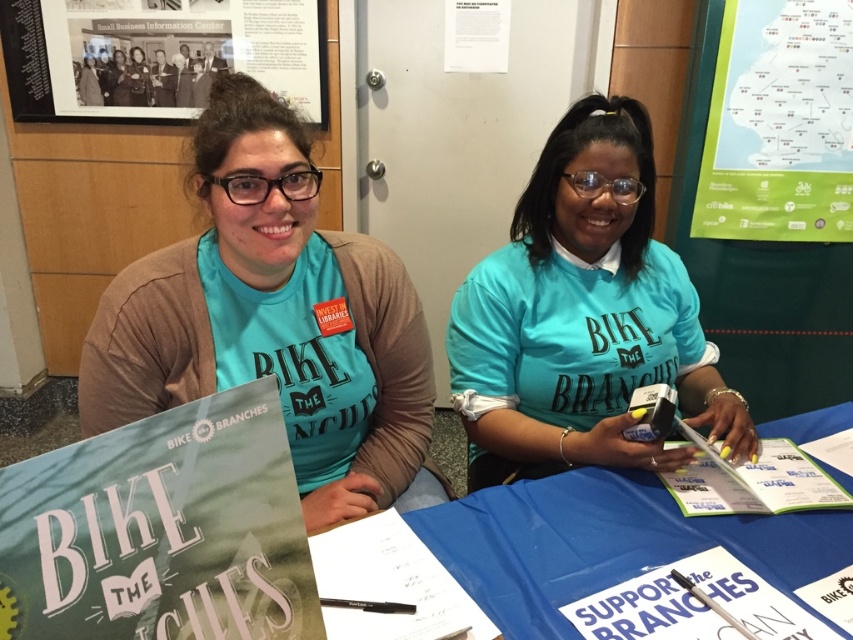
Question: Which point is closer to the camera taking this photo?

Choices:
 (A) (231, 371)
 (B) (221, 592)

Answer: (B)

Question: Does green paper map at upper right have a larger size compared to white paper at lower center?

Choices:
 (A) no
 (B) yes

Answer: (B)

Question: Is blue fabric table at center smaller than white paper at lower center?

Choices:
 (A) yes
 (B) no

Answer: (B)

Question: Which object is the farthest from the blue fabric table at center?

Choices:
 (A) matte green poster at center
 (B) teal matte shirt at center
 (C) green paper map at upper right

Answer: (C)

Question: Is blue fabric table at center smaller than black paper at upper left?

Choices:
 (A) yes
 (B) no

Answer: (B)

Question: Which object is the closest to the teal t-shirt at center?

Choices:
 (A) white paper at lower center
 (B) blue fabric table at center
 (C) teal matte shirt at center
 (D) green paper map at upper right

Answer: (C)